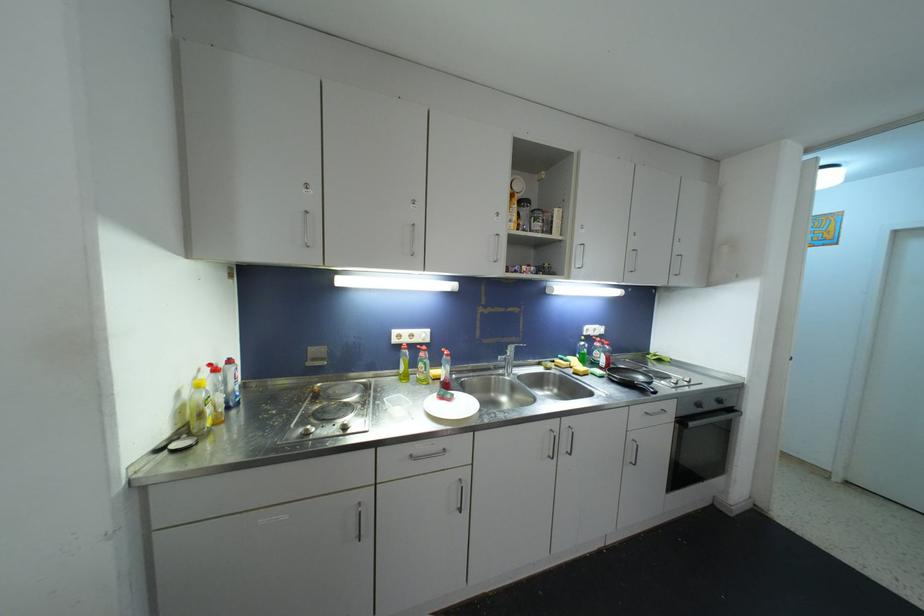
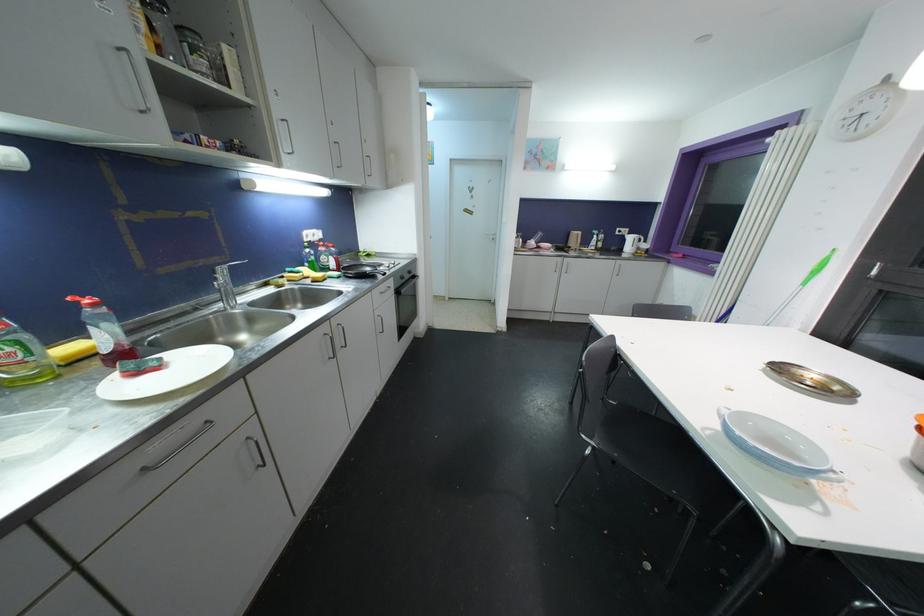
In the second image, find the point that corresponds to [723,403] in the first image.

(412, 275)